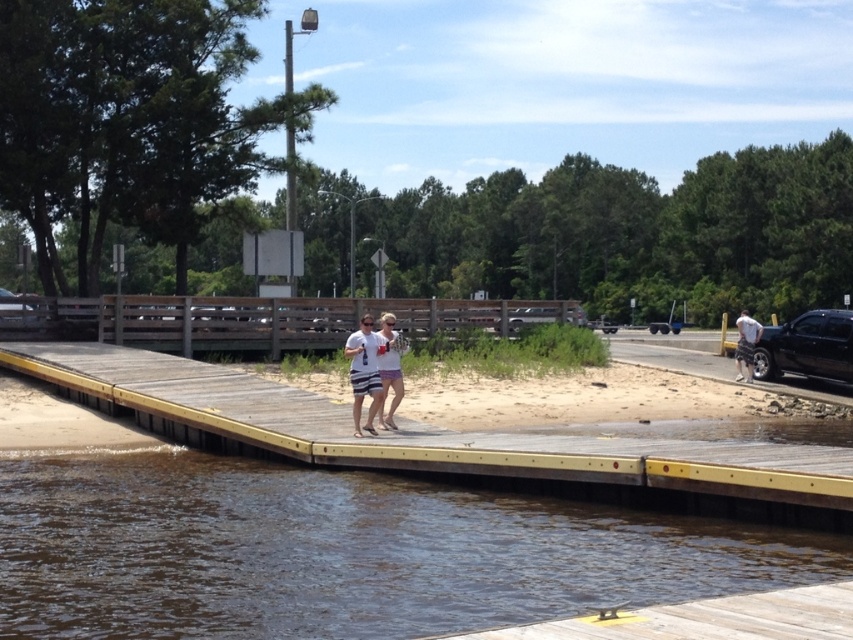
Does white cotton t-shirt at center appear over matte black truck at center?

Result: Incorrect, white cotton t-shirt at center is not positioned above matte black truck at center.

Is point (392, 321) closer to viewer compared to point (514, 326)?

Yes, it is in front of point (514, 326).

Find the location of a particular element. This screenshot has width=853, height=640. white cotton t-shirt at center is located at coordinates (370, 365).

Is matte black truck at center shorter than white cotton shirt at right?

Yes.

Is matte black truck at center to the left of white cotton shirt at right from the viewer's perspective?

Indeed, matte black truck at center is positioned on the left side of white cotton shirt at right.

This screenshot has height=640, width=853. I want to click on matte black truck at center, so [543, 316].

Does brown water at lower left have a lesser height compared to black glossy truck at right?

Indeed, brown water at lower left has a lesser height compared to black glossy truck at right.

Who is taller, brown water at lower left or black glossy truck at right?

black glossy truck at right

Does point (430, 509) come behind point (840, 330)?

No, it is not.

What are the coordinates of `brown water at lower left` in the screenshot? It's located at 344,552.